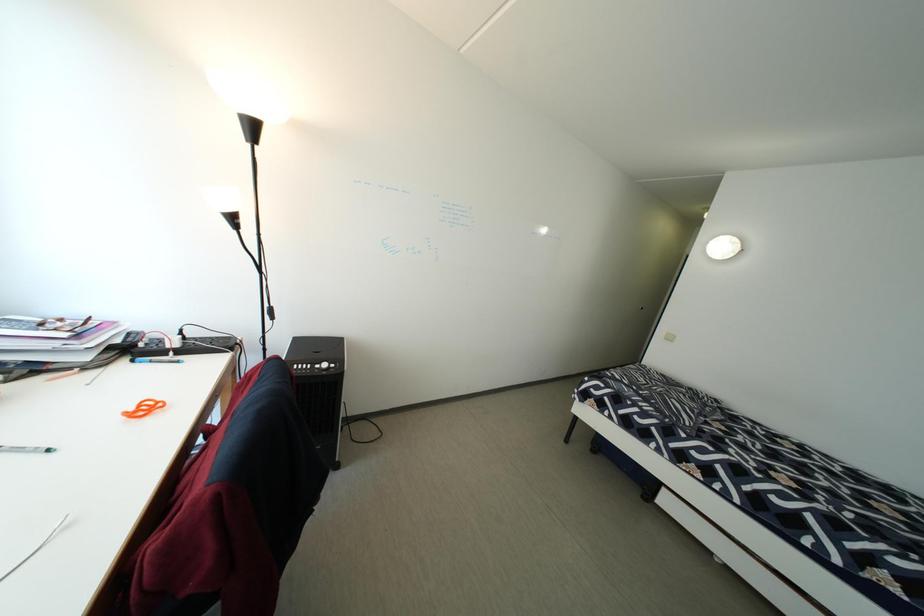
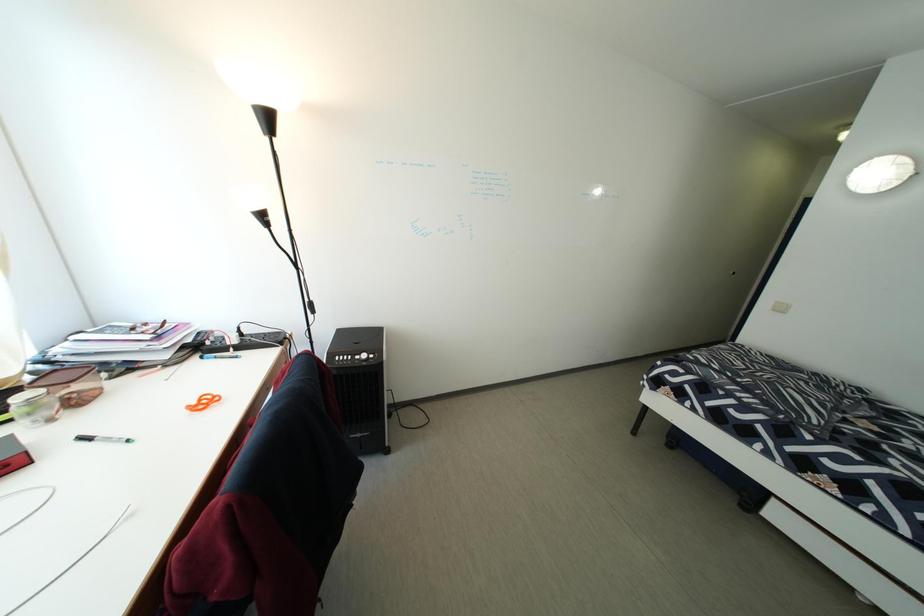
Question: The images are taken continuously from a first-person perspective. In which direction are you moving?

Choices:
 (A) Left
 (B) Right
 (C) Forward
 (D) Backward

Answer: (C)